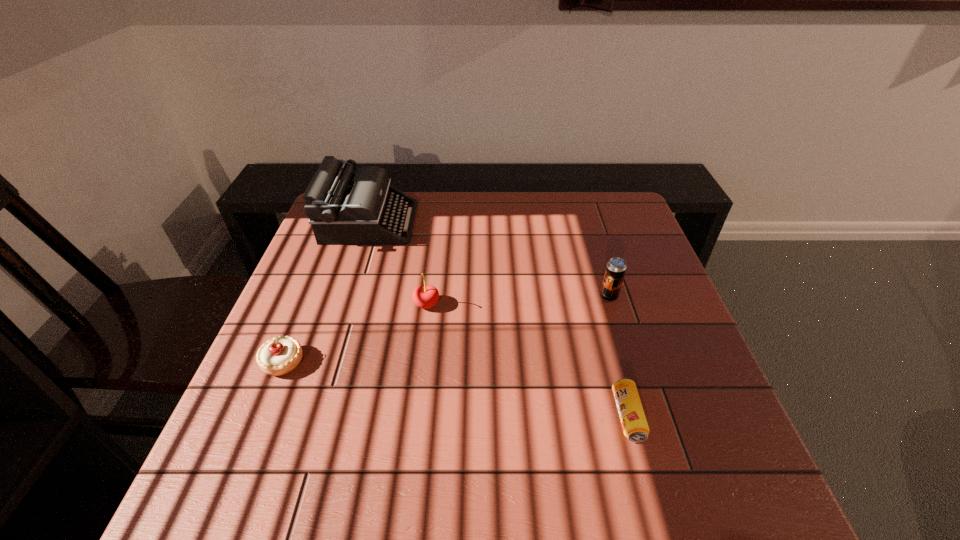
The image size is (960, 540). In order to click on unoccupied position between the tallest object and the cherry in this screenshot , I will do `click(398, 263)`.

At what (x,y) coordinates should I click in order to perform the action: click on vacant area between the third object from right to left and the pastry. Please return your answer as a coordinate pair (x, y). Looking at the image, I should click on (355, 333).

This screenshot has height=540, width=960. I want to click on free space between the pastry and the shortest object, so click(x=456, y=389).

You are a GUI agent. You are given a task and a screenshot of the screen. Output one action in this format:
    pyautogui.click(x=<x>, y=<y>)
    Task: Click on the vacant area that lies between the second nearest object and the farther beer can
    The width and height of the screenshot is (960, 540).
    Given the screenshot: What is the action you would take?
    pyautogui.click(x=446, y=329)

Where is `object that ranks as the second closest to the taller beer can`? Image resolution: width=960 pixels, height=540 pixels. object that ranks as the second closest to the taller beer can is located at coordinates (425, 296).

Identify which object is the closest to the shortest object. Please provide its 2D coordinates. Your answer should be formatted as a tuple, i.e. [(x, y)], where the tuple contains the x and y coordinates of a point satisfying the conditions above.

[(616, 267)]

Find the location of a particular element. Image resolution: width=960 pixels, height=540 pixels. vacant space that satisfies the following two spatial constraints: 1. on the typing side of the shortest object; 2. on the right side of the typewriter is located at coordinates (307, 416).

Locate an element on the screen. The image size is (960, 540). free spot that satisfies the following two spatial constraints: 1. on the typing side of the farthest object; 2. on the right side of the shortest object is located at coordinates [x=307, y=416].

Image resolution: width=960 pixels, height=540 pixels. In order to click on free location that satisfies the following two spatial constraints: 1. on the typing side of the taller beer can; 2. on the left side of the typewriter in this screenshot , I will do `click(346, 296)`.

The height and width of the screenshot is (540, 960). In order to click on vacant point that satisfies the following two spatial constraints: 1. on the typing side of the tallest object; 2. on the left side of the taller beer can in this screenshot , I will do `click(346, 296)`.